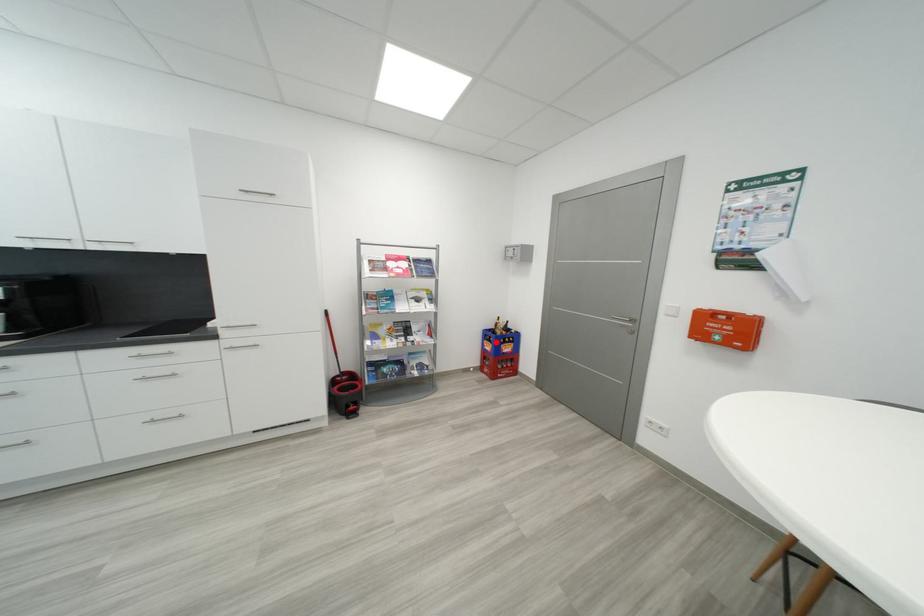
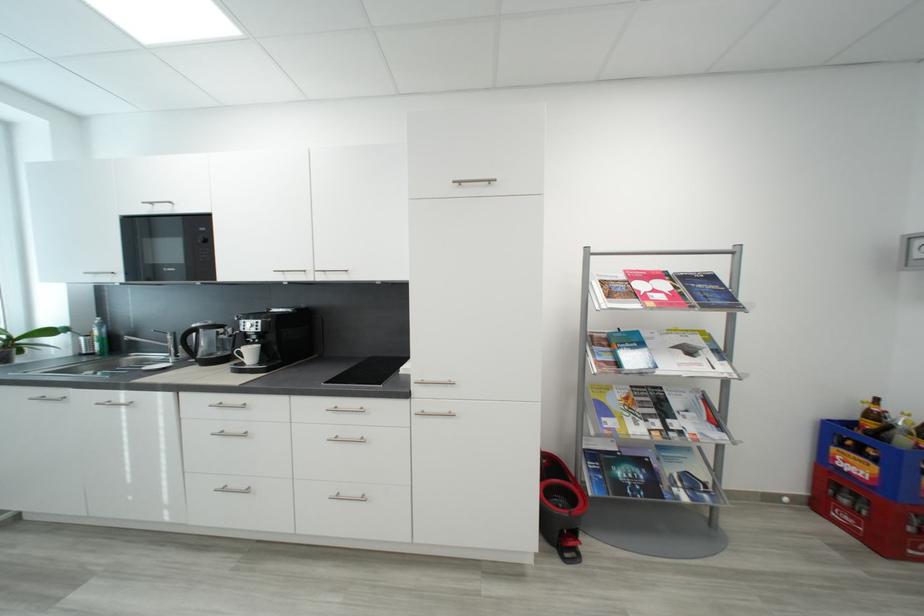
In the second image, find the point that corresponds to the highlighted location in the first image.

(867, 454)